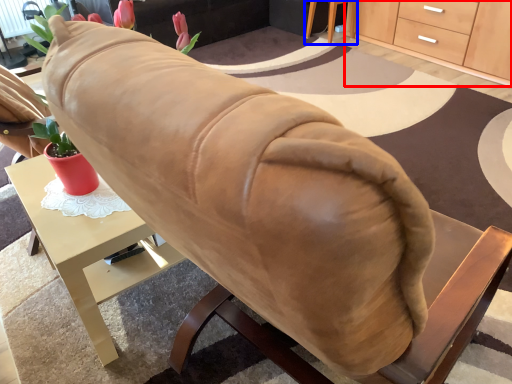
Question: Which of the following is the farthest to the observer, cabinetry (highlighted by a red box) or table (highlighted by a blue box)?

Choices:
 (A) cabinetry
 (B) table

Answer: (B)